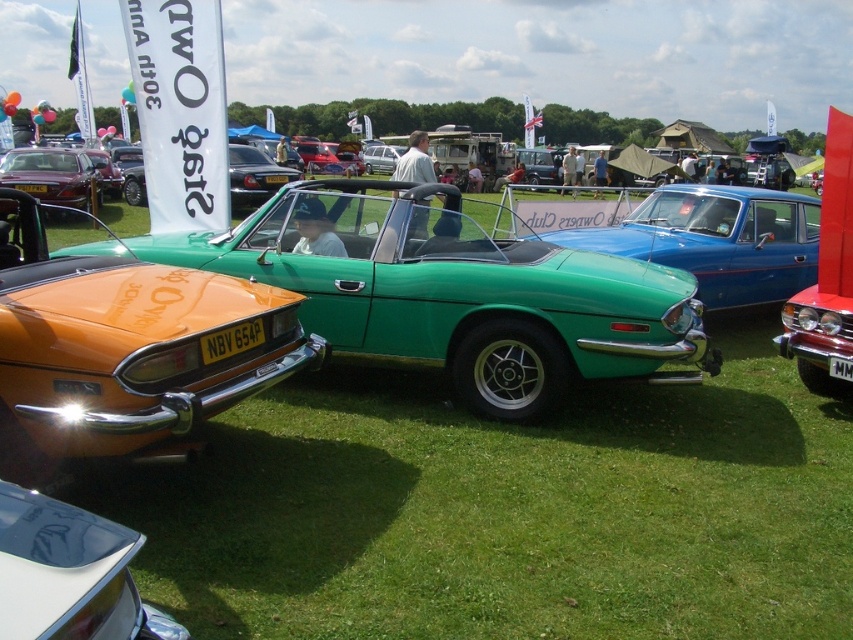
From the picture: You are standing at the edge of the car show field and want to walk towards the shiny silver car at lower left. Which direction should you move relative to the green grass at center?

You should move to the left of the green grass at center to reach the shiny silver car at lower left because the shiny silver car at lower left is located to the left of the green grass at center.

You are standing at the point marked by the coordinate (505, 509) in the image. What is the surface you are currently standing on?

The point at coordinate (505, 509) indicates green grass at center, so you are standing on green grass.

You are a photographer at the car show and want to capture both the orange metallic car at left and the shiny silver car at lower left in a single frame. Considering their heights, which car should be placed closer to the camera to ensure both are fully visible in the photo?

Since the orange metallic car at left is taller than the shiny silver car at lower left, you should place the orange metallic car at left closer to the camera. This way, its height will be better accommodated in the frame while still capturing the shorter shiny silver car at lower left in the background.